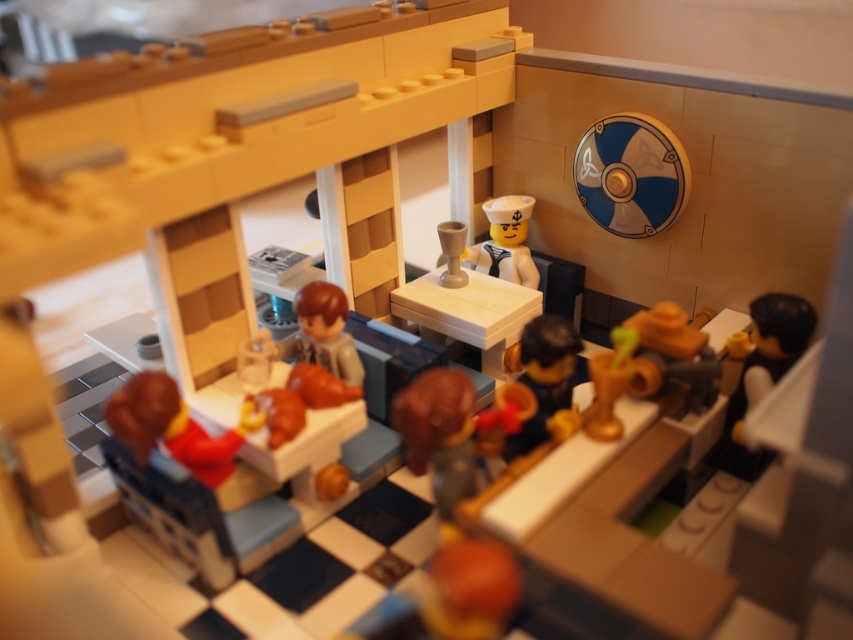
Question: Is shiny brown bowl at center to the left of satin white sailor hat at upper center from the viewer's perspective?

Choices:
 (A) yes
 (B) no

Answer: (B)

Question: Does smooth brown minifigure at center have a lesser width compared to satin white sailor hat at upper center?

Choices:
 (A) yes
 (B) no

Answer: (B)

Question: Which point appears closest to the camera in this image?

Choices:
 (A) (529, 444)
 (B) (511, 252)
 (C) (335, 332)

Answer: (A)

Question: Considering the relative positions of shiny brown bowl at center and smooth brown minifigure at center in the image provided, where is shiny brown bowl at center located with respect to smooth brown minifigure at center?

Choices:
 (A) left
 (B) right

Answer: (B)

Question: Considering the real-world distances, which object is farthest from the shiny brown bowl at center?

Choices:
 (A) satin white sailor hat at upper center
 (B) smooth brown minifigure at center

Answer: (A)

Question: Which point appears farthest from the camera in this image?

Choices:
 (A) (343, 368)
 (B) (486, 257)

Answer: (B)